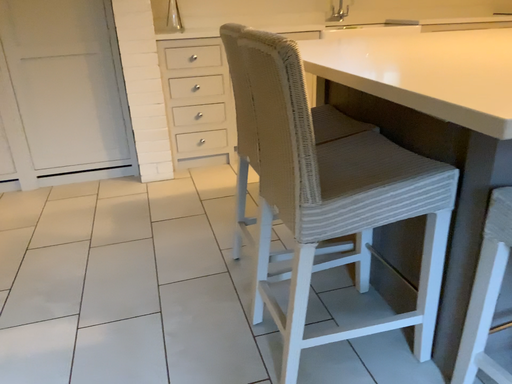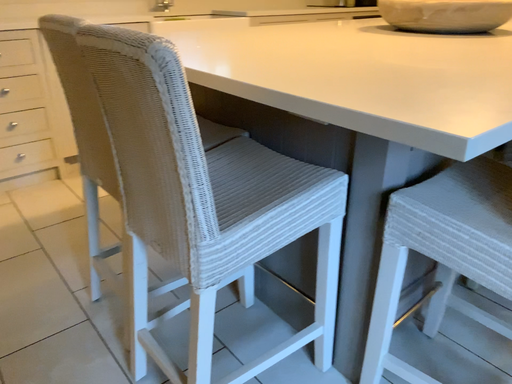
Question: How did the camera likely rotate when shooting the video?

Choices:
 (A) rotated right
 (B) rotated left

Answer: (A)